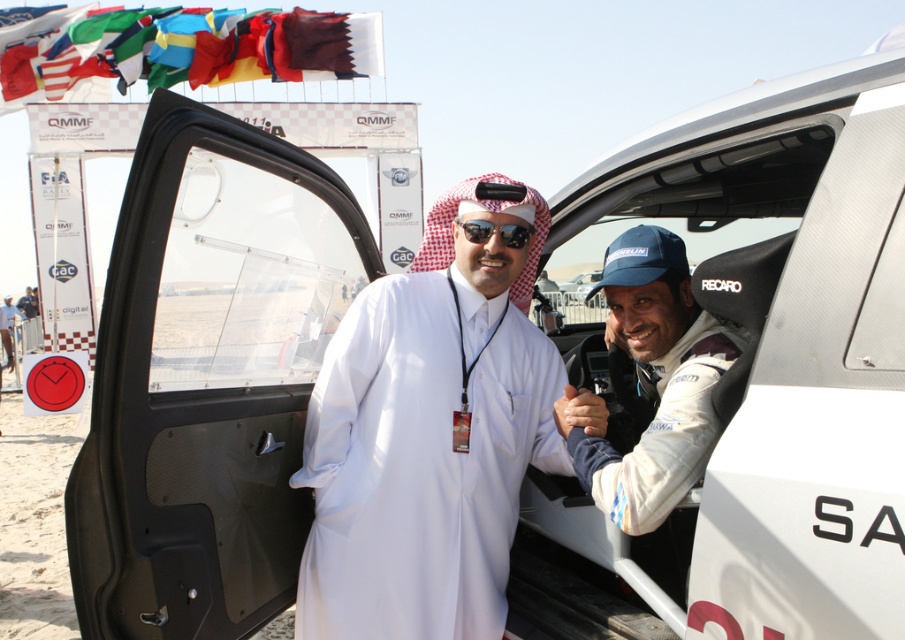
Who is positioned more to the left, white matte robe at center or white leather racing suit at center?

From the viewer's perspective, white matte robe at center appears more on the left side.

Is point (522, 420) in front of point (692, 426)?

No, (522, 420) is behind (692, 426).

Identify the location of white matte robe at center. (421, 460).

Is white leather racing suit at center bigger than sunglasses at center?

Correct, white leather racing suit at center is larger in size than sunglasses at center.

Which is below, white leather racing suit at center or sunglasses at center?

white leather racing suit at center is below.

You are a GUI agent. You are given a task and a screenshot of the screen. Output one action in this format:
    pyautogui.click(x=<x>, y=<y>)
    Task: Click on the white leather racing suit at center
    Image resolution: width=905 pixels, height=640 pixels.
    Given the screenshot: What is the action you would take?
    pyautogui.click(x=656, y=380)

This screenshot has height=640, width=905. In order to click on white leather racing suit at center in this screenshot , I will do `click(656, 380)`.

Can you confirm if white matte robe at center is positioned below sunglasses at center?

Indeed, white matte robe at center is positioned under sunglasses at center.

Image resolution: width=905 pixels, height=640 pixels. What do you see at coordinates (421, 460) in the screenshot?
I see `white matte robe at center` at bounding box center [421, 460].

Locate an element on the screen. white matte robe at center is located at coordinates (421, 460).